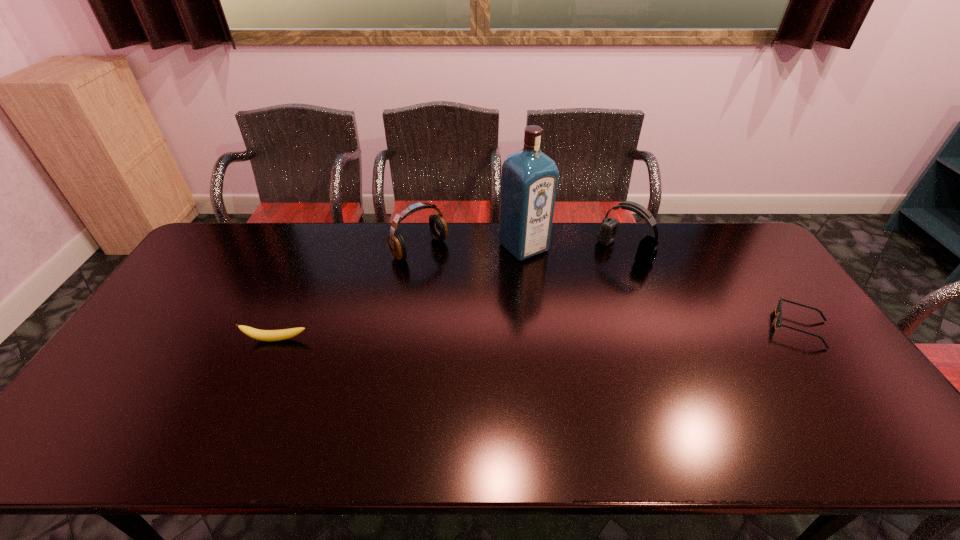
At what (x,y) coordinates should I click in order to perform the action: click on vacant point located on the lenses of the rightmost object. Please return your answer as a coordinate pair (x, y). This screenshot has width=960, height=540. Looking at the image, I should click on (717, 327).

You are a GUI agent. You are given a task and a screenshot of the screen. Output one action in this format:
    pyautogui.click(x=<x>, y=<y>)
    Task: Click on the free space located on the lenses of the rightmost object
    
    Given the screenshot: What is the action you would take?
    pyautogui.click(x=734, y=327)

Find the location of `vacant space situated on the ear cups of the left headset`. vacant space situated on the ear cups of the left headset is located at coordinates (514, 328).

The height and width of the screenshot is (540, 960). Find the location of `free spot located 0.220m on the ear cups of the left headset`. free spot located 0.220m on the ear cups of the left headset is located at coordinates (478, 298).

I want to click on vacant space located on the ear cups of the left headset, so click(452, 276).

This screenshot has width=960, height=540. Find the location of `vacant space situated on the flat label side of the liquor`. vacant space situated on the flat label side of the liquor is located at coordinates (577, 296).

Where is `vacant space located on the flat label side of the liquor`? The height and width of the screenshot is (540, 960). vacant space located on the flat label side of the liquor is located at coordinates (612, 328).

You are a GUI agent. You are given a task and a screenshot of the screen. Output one action in this format:
    pyautogui.click(x=<x>, y=<y>)
    Task: Click on the free space located on the flat label side of the liquor
    
    Given the screenshot: What is the action you would take?
    pyautogui.click(x=547, y=269)

The image size is (960, 540). I want to click on free space located 0.370m on the headband of the right headset, so click(x=538, y=320).

The width and height of the screenshot is (960, 540). In order to click on free space located on the headband of the right headset in this screenshot , I will do `click(594, 275)`.